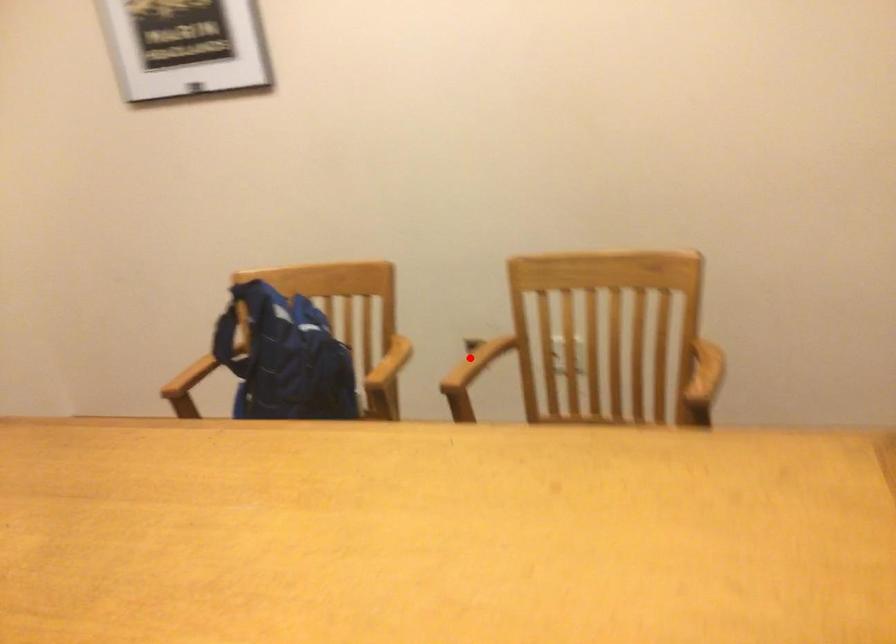
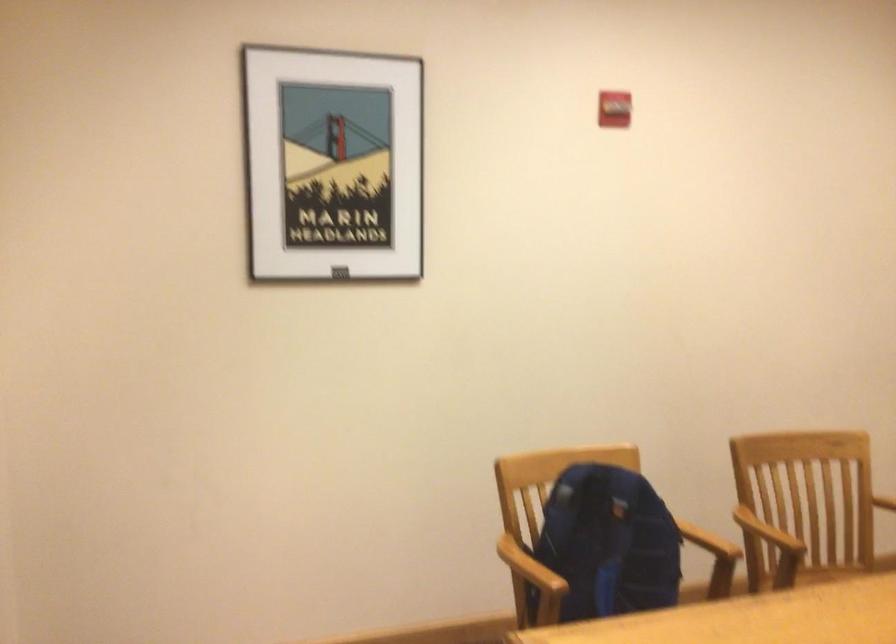
Question: I am providing you with two images of the same scene from different viewpoints. A red point is shown in image1. For the corresponding object point in image2, is it positioned nearer or farther from the camera?

Choices:
 (A) Nearer
 (B) Farther

Answer: (B)